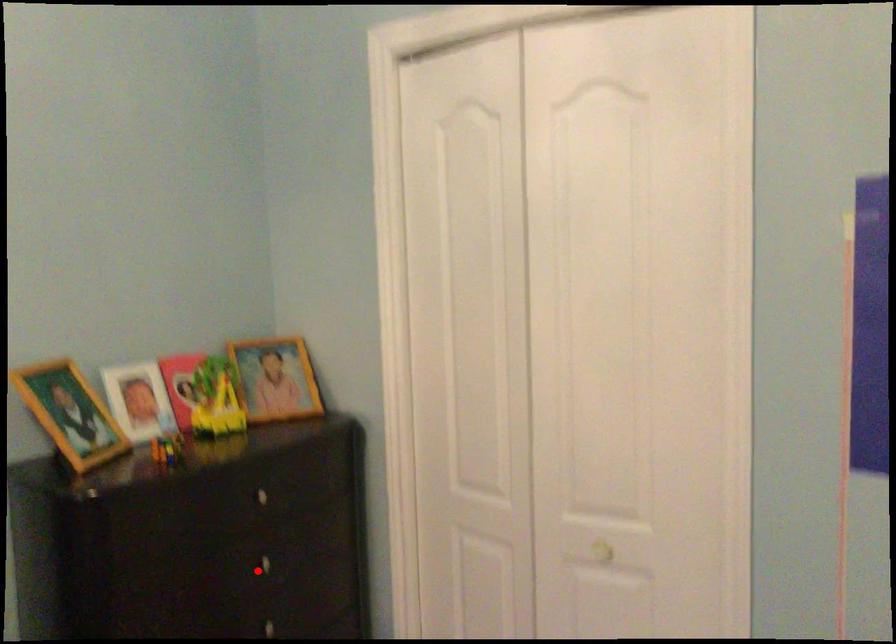
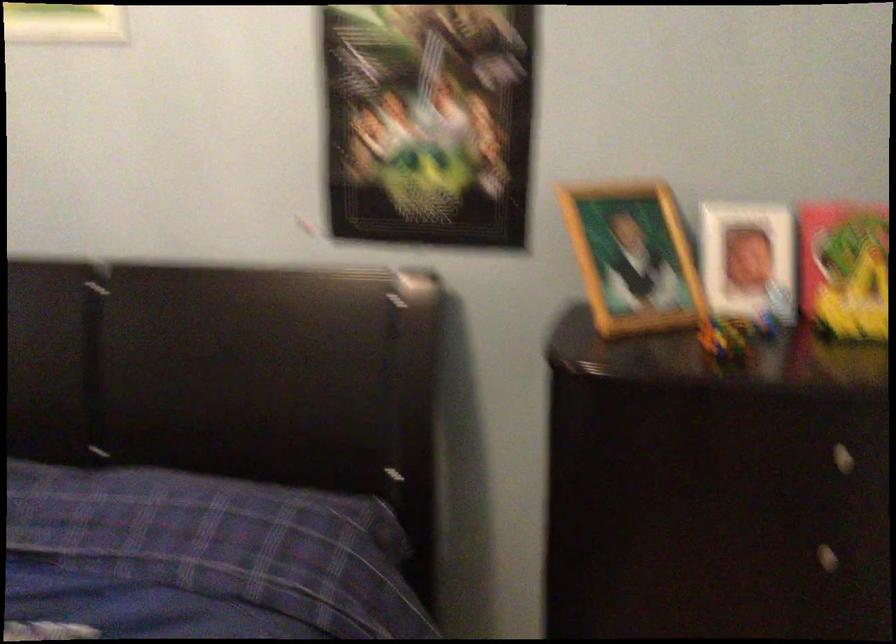
Question: I am providing you with two images of the same scene from different viewpoints. Given a red point in image1, look at the same physical point in image2. Is it:

Choices:
 (A) Closer to the viewpoint
 (B) Farther from the viewpoint

Answer: (A)